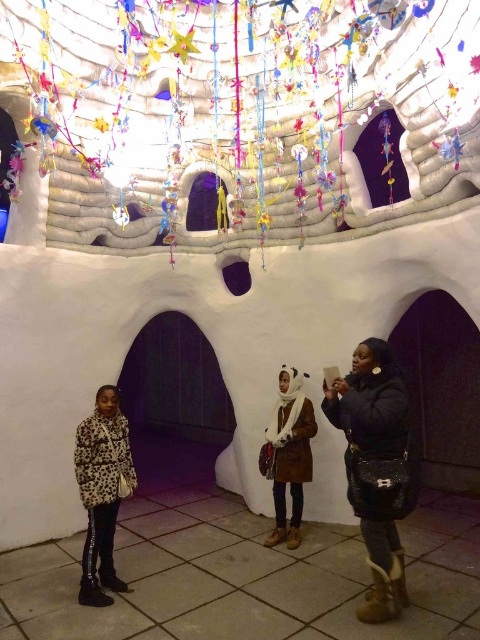
In the scene shown: You are a delivery robot with a width of 2.5 feet. You need to move from the entrance to the black quilted purse at lower right while avoiding the white fluffy scarf at center. Can you safely navigate the space between them?

The distance between the black quilted purse at lower right and the white fluffy scarf at center is 3.83 feet. Since the robot is 2.5 feet wide, it can safely pass through the space as the distance is greater than the robot width.

You are standing in the room and want to pick up the leopard print coat at lower left and the white fluffy scarf at center. Which item should you reach for first if you want to grab the one closer to you?

The leopard print coat at lower left is closer to the viewer, so you should reach for it first.